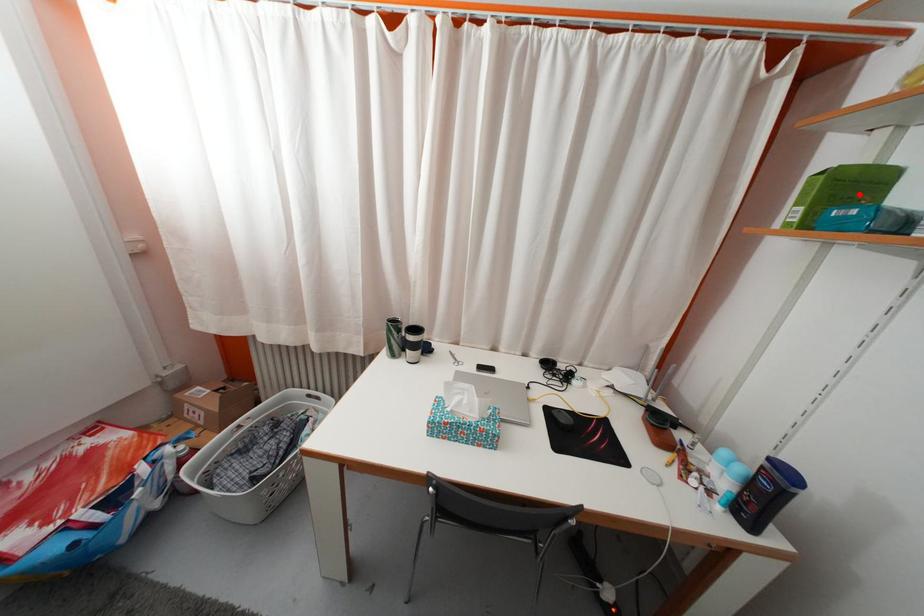
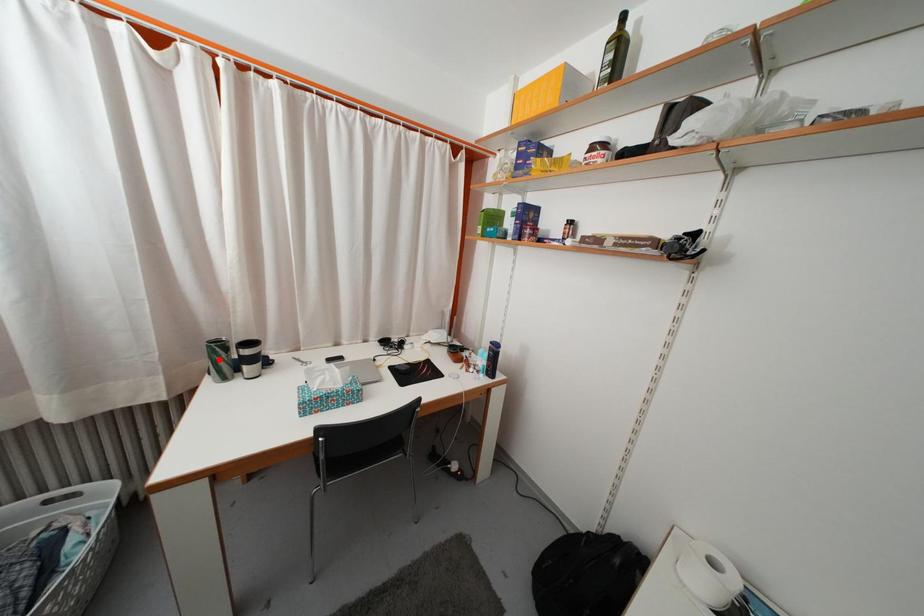
I am providing you with two images of the same scene from different viewpoints. A red point is marked on the first image and another point is marked on the second image. Does the point marked in image1 correspond to the same location as the one in image2?

No